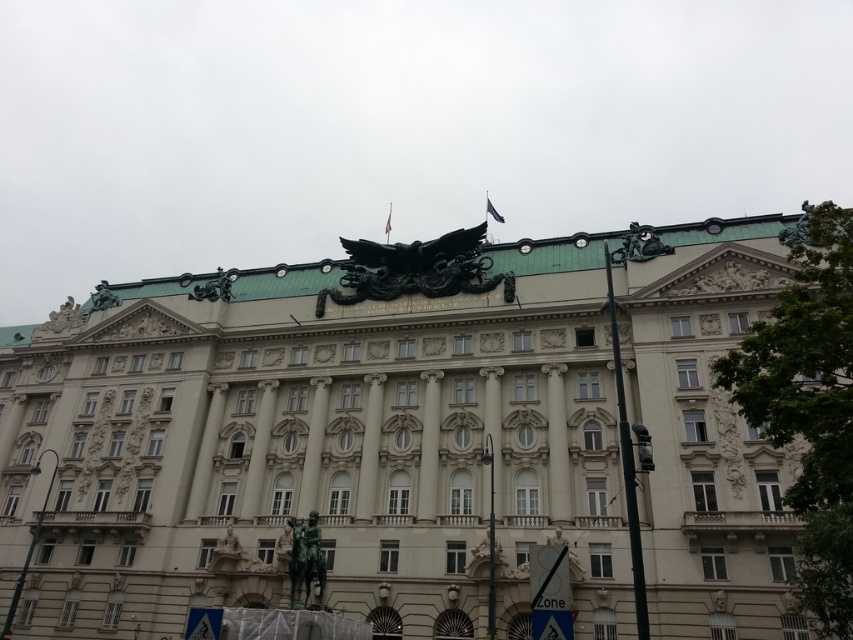
Does bronze statue at center have a lesser width compared to green stone sculpture at upper center?

Indeed, bronze statue at center has a lesser width compared to green stone sculpture at upper center.

Which is in front, point (312, 572) or point (196, 285)?

Point (312, 572)

You are a GUI agent. You are given a task and a screenshot of the screen. Output one action in this format:
    pyautogui.click(x=<x>, y=<y>)
    Task: Click on the bronze statue at center
    The image size is (853, 640).
    Given the screenshot: What is the action you would take?
    pyautogui.click(x=305, y=561)

Between bronze statue at center and bronze/golden statue at upper left, which one appears on the right side from the viewer's perspective?

bronze statue at center is more to the right.

Between bronze statue at center and bronze/golden statue at upper left, which one is positioned lower?

Positioned lower is bronze statue at center.

Measure the distance between bronze statue at center and camera.

bronze statue at center is 43.29 meters away from camera.

Find the location of a particular element. The image size is (853, 640). bronze statue at center is located at coordinates (305, 561).

Which is in front, point (318, 596) or point (636, 244)?

Point (318, 596) is more forward.

Which is in front, point (293, 563) or point (654, 253)?

Positioned in front is point (293, 563).

The height and width of the screenshot is (640, 853). Find the location of `bronze statue at center`. bronze statue at center is located at coordinates (305, 561).